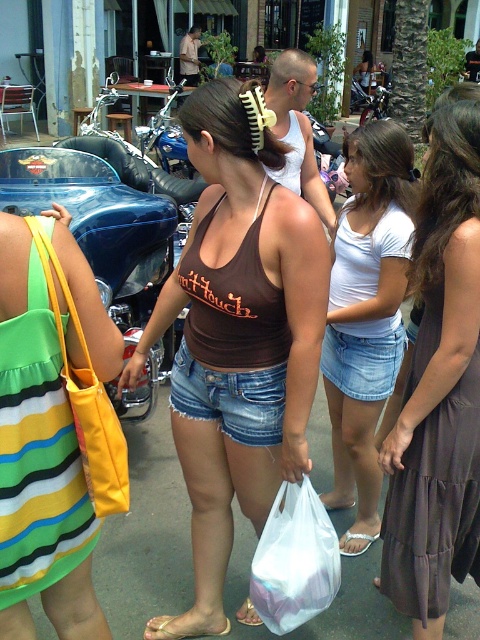
Which is below, brown cotton dress at right or brown tank top at center?

brown cotton dress at right is lower down.

Who is positioned more to the left, brown cotton dress at right or brown tank top at center?

Positioned to the left is brown tank top at center.

Image resolution: width=480 pixels, height=640 pixels. What do you see at coordinates (439, 390) in the screenshot? I see `brown cotton dress at right` at bounding box center [439, 390].

Image resolution: width=480 pixels, height=640 pixels. In order to click on brown cotton dress at right in this screenshot , I will do `click(439, 390)`.

Is white plastic bag at lower center thinner than tan leather sandal at lower left?

Correct, white plastic bag at lower center's width is less than tan leather sandal at lower left's.

Where is `white plastic bag at lower center`? This screenshot has width=480, height=640. white plastic bag at lower center is located at coordinates (295, 560).

Does yellow fabric bag at left appear over shiny blue motorcycle at center-left?

Actually, yellow fabric bag at left is below shiny blue motorcycle at center-left.

Does yellow fabric bag at left have a greater width compared to shiny blue motorcycle at center-left?

Incorrect, yellow fabric bag at left's width does not surpass shiny blue motorcycle at center-left's.

What do you see at coordinates (54, 429) in the screenshot?
I see `yellow fabric bag at left` at bounding box center [54, 429].

Where is `yellow fabric bag at left`? yellow fabric bag at left is located at coordinates (54, 429).